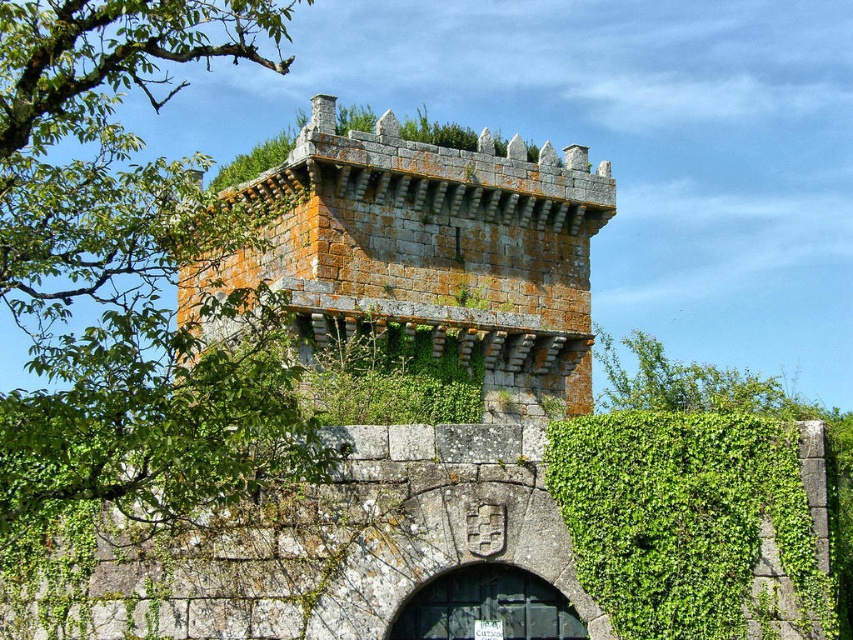
Which is above, green leafy tree at upper left or gray stone tower at center?

green leafy tree at upper left is above.

Based on the photo, does green leafy tree at upper left have a lesser height compared to gray stone tower at center?

Incorrect, green leafy tree at upper left's height does not fall short of gray stone tower at center's.

At what (x,y) coordinates should I click in order to perform the action: click on green leafy tree at upper left. Please return your answer as a coordinate pair (x, y). Looking at the image, I should click on (125, 282).

Locate an element on the screen. This screenshot has width=853, height=640. green leafy tree at upper left is located at coordinates (125, 282).

Is green leafy tree at upper left positioned behind green leafy hedge at lower right?

No, green leafy tree at upper left is closer to the viewer.

Can you confirm if green leafy tree at upper left is bigger than green leafy hedge at lower right?

Yes, green leafy tree at upper left is bigger than green leafy hedge at lower right.

The height and width of the screenshot is (640, 853). I want to click on green leafy tree at upper left, so click(125, 282).

Identify the location of green leafy tree at upper left. (125, 282).

Is gray stone tower at center positioned behind green leafy hedge at lower right?

Yes, gray stone tower at center is behind green leafy hedge at lower right.

Does gray stone tower at center appear over green leafy hedge at lower right?

Indeed, gray stone tower at center is positioned over green leafy hedge at lower right.

What do you see at coordinates (432, 252) in the screenshot?
I see `gray stone tower at center` at bounding box center [432, 252].

The image size is (853, 640). I want to click on gray stone tower at center, so click(x=432, y=252).